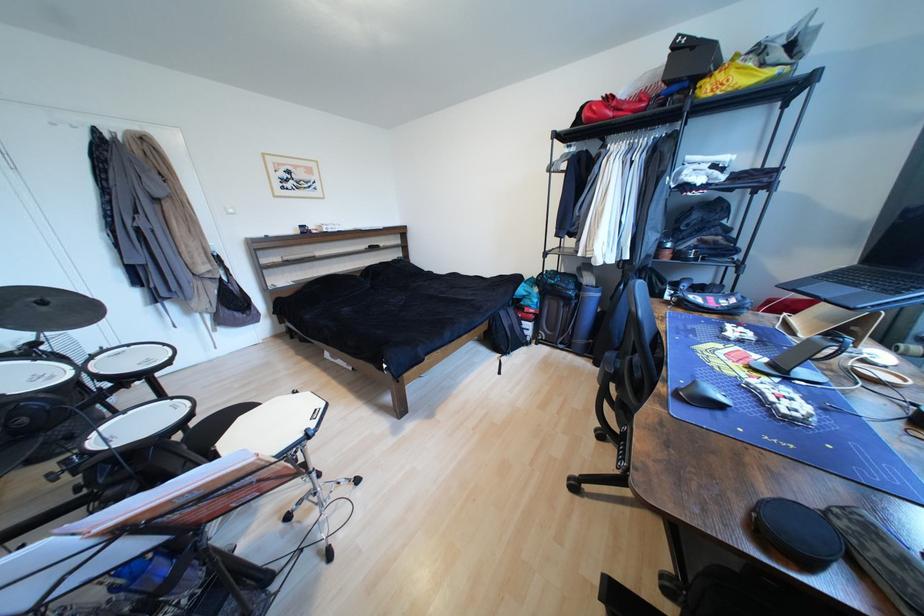
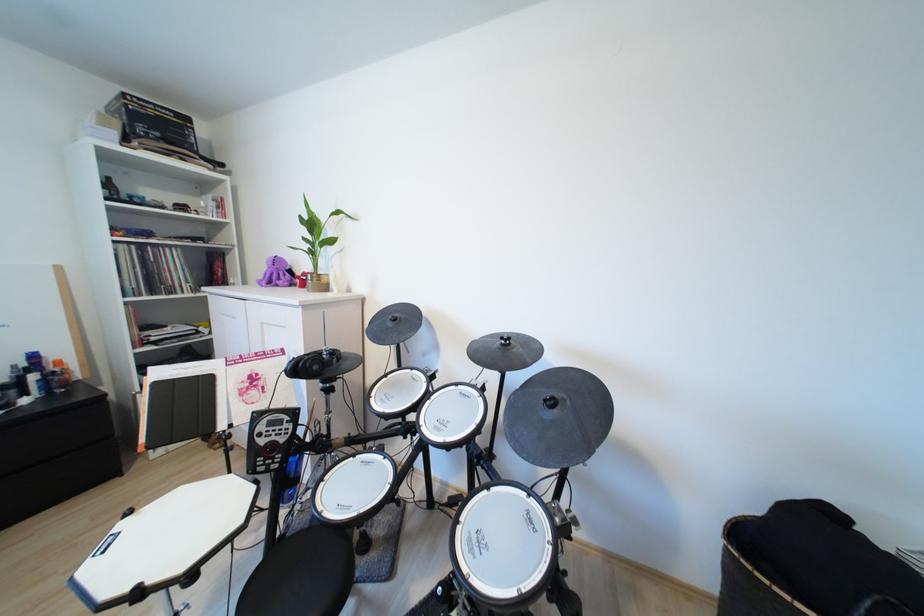
Locate, in the second image, the point that corresponds to the point at 49,305 in the first image.

(560, 405)